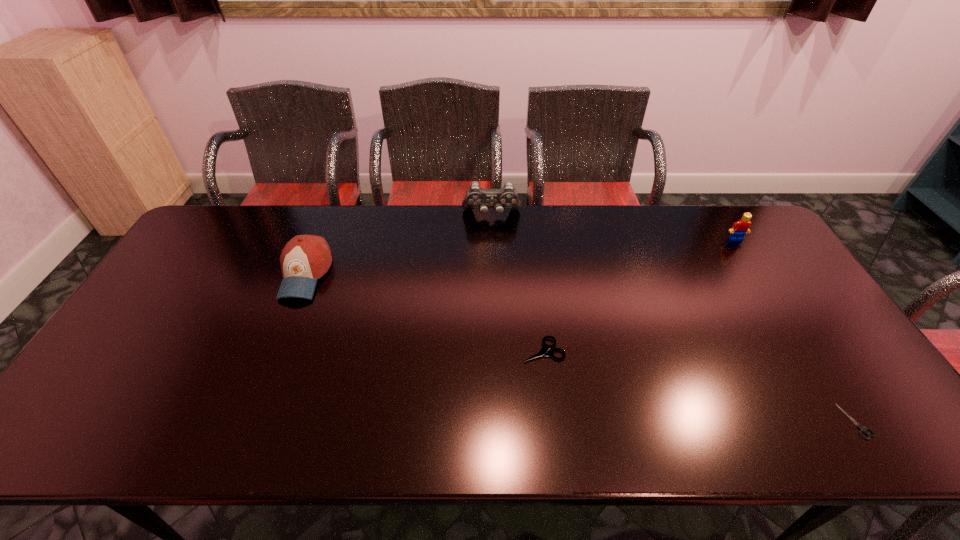
At what (x,y) coordinates should I click in order to perform the action: click on control. Please return your answer as a coordinate pair (x, y). Looking at the image, I should click on (476, 197).

The image size is (960, 540). Identify the location of the tallest object. (476, 197).

The image size is (960, 540). I want to click on the second farthest object, so click(739, 229).

Locate an element on the screen. the leftmost object is located at coordinates (305, 258).

I want to click on baseball cap, so click(305, 258).

Locate an element on the screen. the second nearest object is located at coordinates (544, 351).

Identify the location of the left shears. The width and height of the screenshot is (960, 540). (544, 351).

At what (x,y) coordinates should I click in order to perform the action: click on the shorter shears. Please return your answer as a coordinate pair (x, y). This screenshot has width=960, height=540. Looking at the image, I should click on (862, 429).

At what (x,y) coordinates should I click in order to perform the action: click on the nearer shears. Please return your answer as a coordinate pair (x, y). The height and width of the screenshot is (540, 960). Looking at the image, I should click on (862, 429).

Identify the location of vacant space located 0.400m on the surface of the control with buttons. (494, 310).